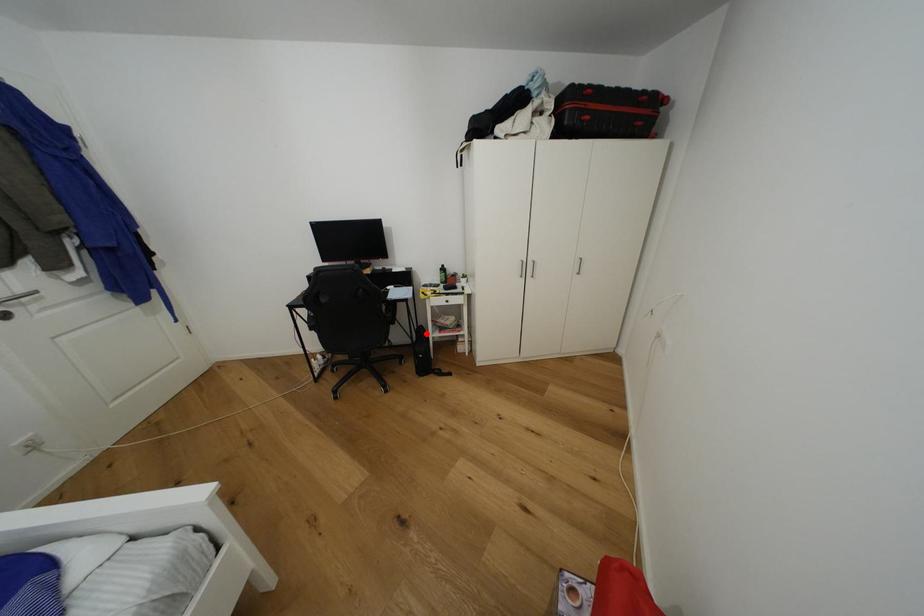
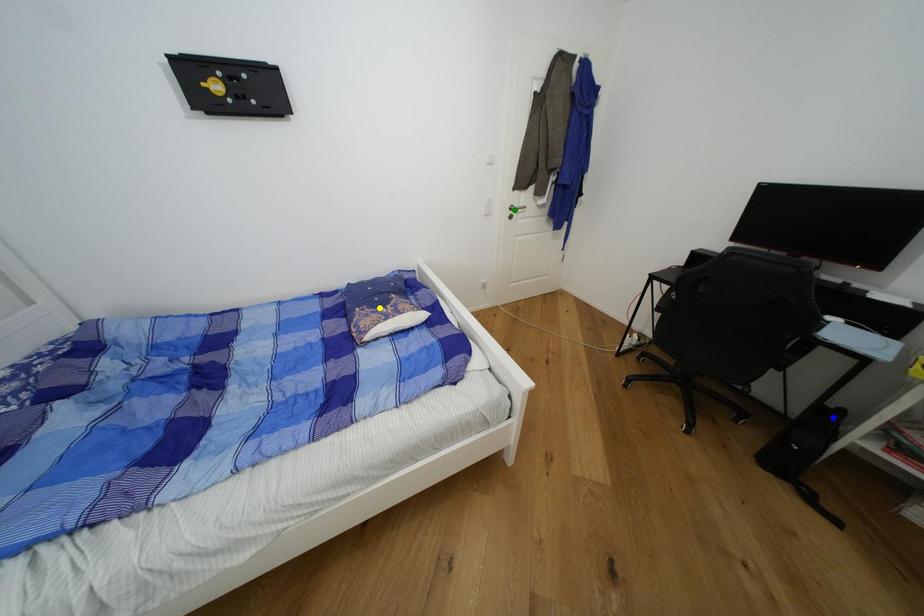
Question: I am providing you with two images of the same scene from different viewpoints. A red point is marked on the first image. You are given multiple points on the second image. Which spot in image 2 lines up with the point in image 1?

Choices:
 (A) yellow point
 (B) blue point
 (C) green point

Answer: (B)